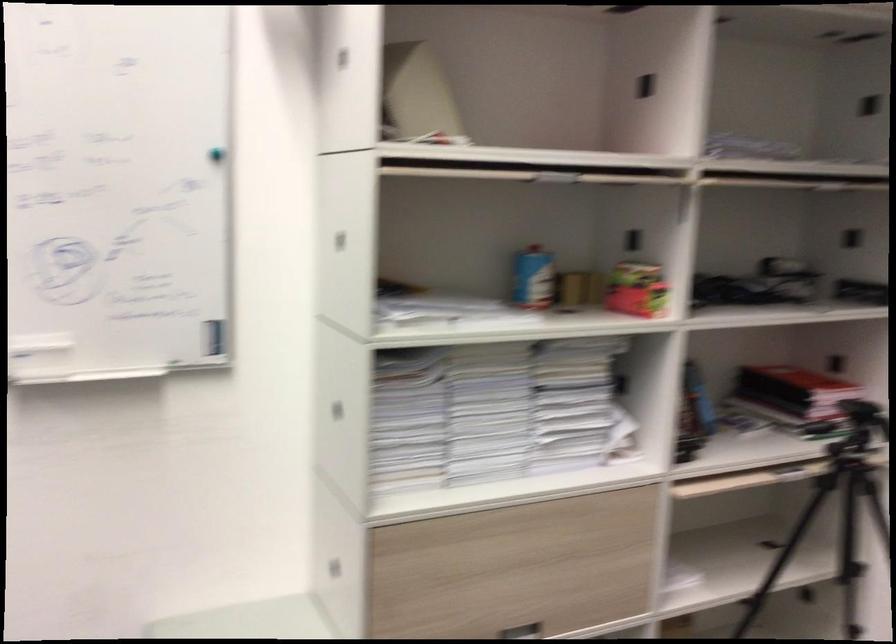
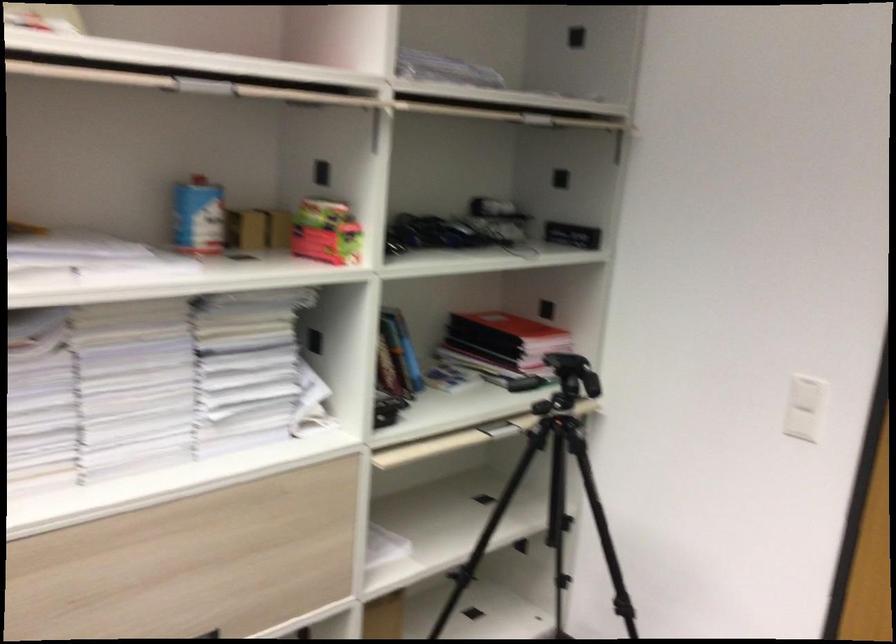
The images are taken continuously from a first-person perspective. In which direction are you moving?

The cameraman walked toward right, forward.